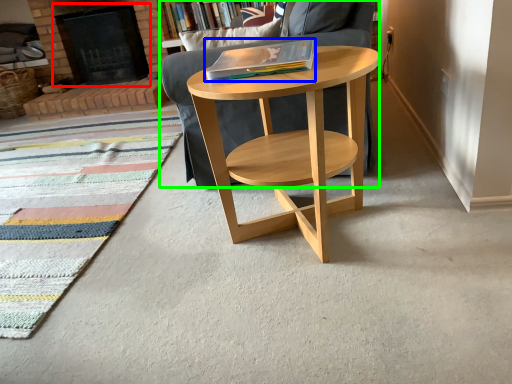
Question: Considering the real-world distances, which object is farthest from fireplace (highlighted by a red box)? book (highlighted by a blue box) or chair (highlighted by a green box)?

Choices:
 (A) book
 (B) chair

Answer: (A)